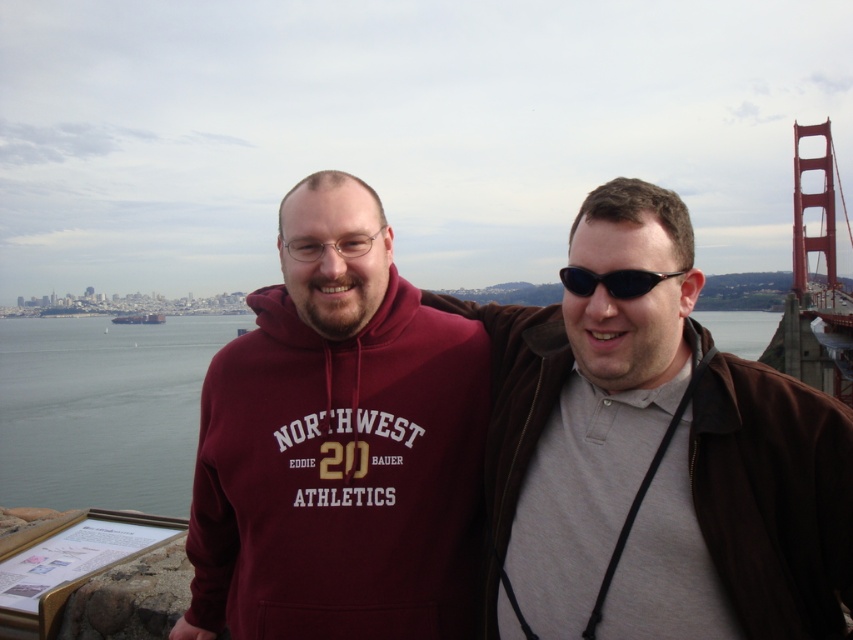
Can you confirm if brown leather jacket at right is thinner than maroon hoodie at center?

Incorrect, brown leather jacket at right's width is not less than maroon hoodie at center's.

Is brown leather jacket at right in front of maroon hoodie at center?

That is True.

Does point (682, 262) lie behind point (447, 614)?

No, it is not.

Image resolution: width=853 pixels, height=640 pixels. In order to click on brown leather jacket at right in this screenshot , I will do `click(583, 397)`.

Can you confirm if maroon hoodie at center is positioned to the right of black plastic goggles at center?

No, maroon hoodie at center is not to the right of black plastic goggles at center.

Who is shorter, maroon hoodie at center or black plastic goggles at center?

Standing shorter between the two is black plastic goggles at center.

Locate an element on the screen. The width and height of the screenshot is (853, 640). maroon hoodie at center is located at coordinates (338, 444).

Where is `maroon hoodie at center`? maroon hoodie at center is located at coordinates (338, 444).

In order to click on brown leather jacket at right in this screenshot , I will do `click(583, 397)`.

Is brown leather jacket at right positioned at the back of black plastic goggles at center?

No, brown leather jacket at right is closer to the viewer.

Measure the distance between point (491, 317) and camera.

A distance of 38.49 meters exists between point (491, 317) and camera.

At what (x,y) coordinates should I click in order to perform the action: click on brown leather jacket at right. Please return your answer as a coordinate pair (x, y). The width and height of the screenshot is (853, 640). Looking at the image, I should click on click(583, 397).